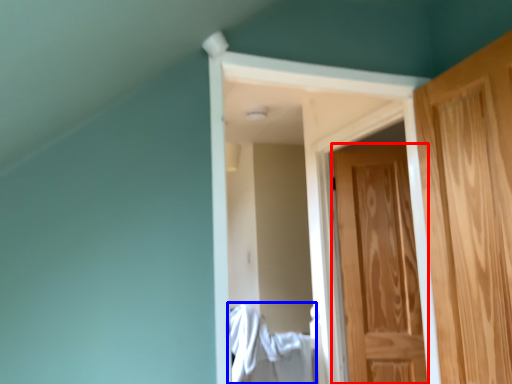
Question: Which of the following is the farthest to the observer, door (highlighted by a red box) or laundry (highlighted by a blue box)?

Choices:
 (A) door
 (B) laundry

Answer: (A)